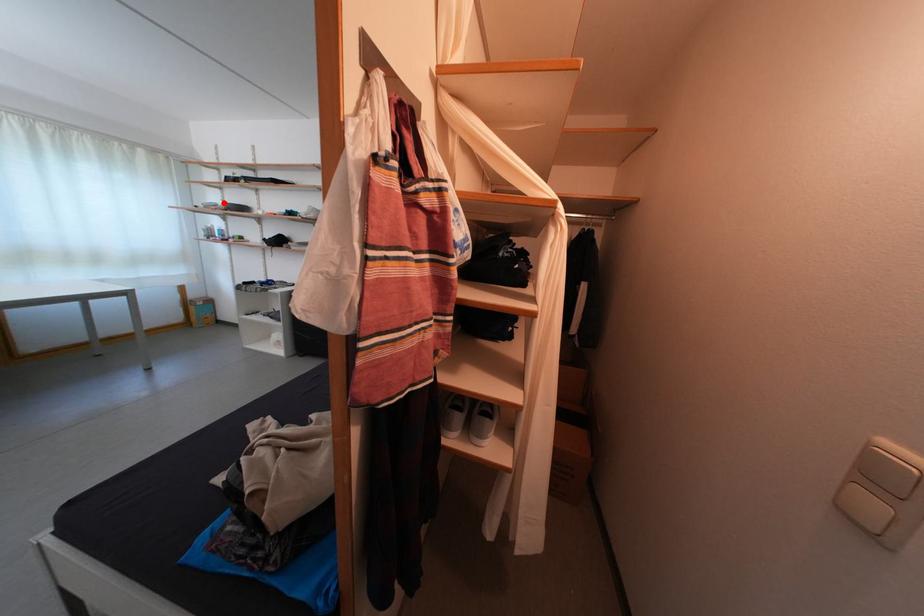
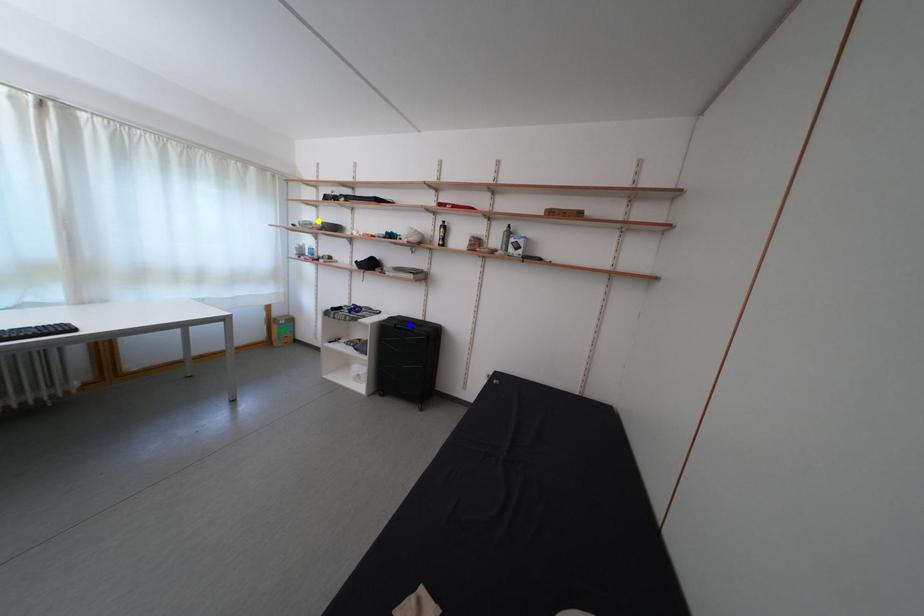
Question: I am providing you with two images of the same scene from different viewpoints. A red point is marked on the first image. You are given multiple points on the second image. In image 2, which mark is for the same physical point as the one in image 1?

Choices:
 (A) yellow point
 (B) blue point
 (C) green point

Answer: (A)